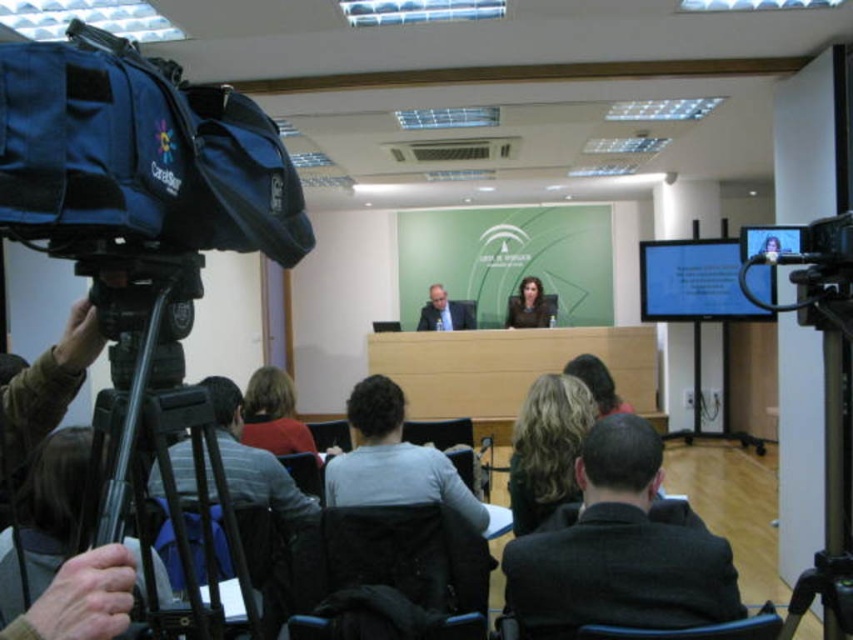
Where is `dark gray suit at center`? dark gray suit at center is located at coordinates (619, 548).

Who is higher up, dark gray suit at center or blonde hair at center?

Result: Positioned higher is blonde hair at center.

Describe the element at coordinates (619, 548) in the screenshot. The height and width of the screenshot is (640, 853). I see `dark gray suit at center` at that location.

Where is `dark gray suit at center`? dark gray suit at center is located at coordinates (619, 548).

Is dark gray suit at center positioned at the back of black plastic tripod at left?

Yes, it is.

Which of these two, dark gray suit at center or black plastic tripod at left, stands taller?

With more height is black plastic tripod at left.

This screenshot has width=853, height=640. In order to click on dark gray suit at center in this screenshot , I will do `click(619, 548)`.

Is black plastic tripod at left thinner than gray fabric jacket at lower left?

Yes, black plastic tripod at left is thinner than gray fabric jacket at lower left.

Who is more distant from viewer, (149, 429) or (177, 444)?

The point (177, 444) is behind.

Where is `black plastic tripod at left`? This screenshot has height=640, width=853. black plastic tripod at left is located at coordinates (164, 458).